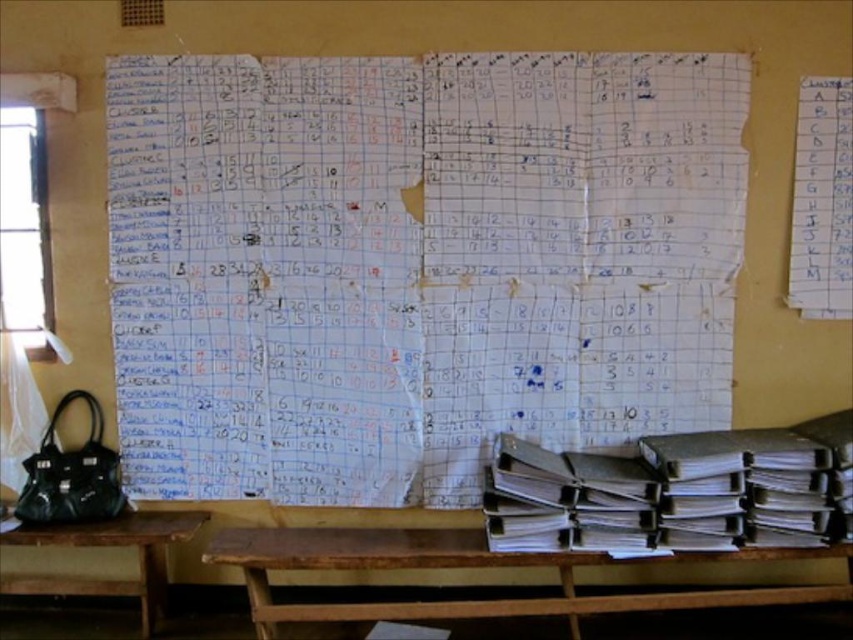
Which is in front, point (215, 378) or point (125, 525)?

Point (125, 525)

This screenshot has height=640, width=853. Describe the element at coordinates (415, 264) in the screenshot. I see `white paper at center` at that location.

From the picture: Who is more forward, (412, 380) or (9, 532)?

Point (9, 532) is in front.

The width and height of the screenshot is (853, 640). In order to click on white paper at center in this screenshot , I will do `click(415, 264)`.

Looking at this image, is white paper at center further to camera compared to brown wooden table at lower center?

That is True.

Who is positioned more to the left, white paper at center or brown wooden table at lower center?

white paper at center

Who is more forward, (577, 108) or (729, 589)?

Point (577, 108)

Find the location of `white paper at center`. white paper at center is located at coordinates (415, 264).

Is point (368, 532) less distant than point (160, 548)?

That is True.

Who is taller, brown wooden table at lower center or brown wooden table at lower left?

brown wooden table at lower left is taller.

Describe the element at coordinates (473, 566) in the screenshot. I see `brown wooden table at lower center` at that location.

The image size is (853, 640). I want to click on brown wooden table at lower center, so click(473, 566).